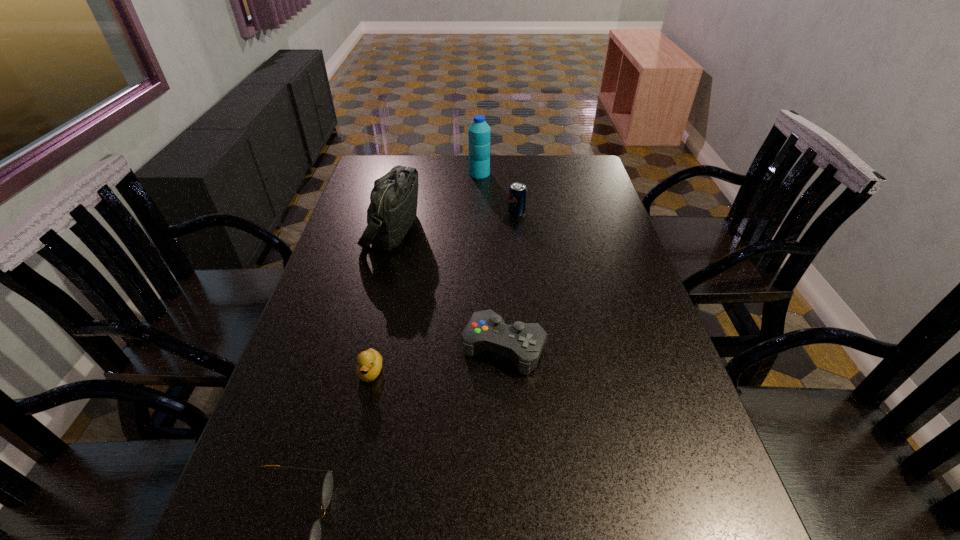
Identify the location of free point between the shoulder bag and the control. The height and width of the screenshot is (540, 960). (448, 288).

The height and width of the screenshot is (540, 960). I want to click on free space between the soda can and the control, so point(510,280).

Locate an element on the screen. The height and width of the screenshot is (540, 960). free spot between the control and the shoulder bag is located at coordinates (448, 288).

The image size is (960, 540). I want to click on free point between the third tallest object and the shoulder bag, so (x=454, y=221).

This screenshot has width=960, height=540. Find the location of `vacant region between the control and the water bottle`. vacant region between the control and the water bottle is located at coordinates (492, 260).

Select which object is the fourth closest to the duckling. Please provide its 2D coordinates. Your answer should be formatted as a tuple, i.e. [(x, y)], where the tuple contains the x and y coordinates of a point satisfying the conditions above.

[(517, 193)]

Identify which object is the third closest to the control. Please provide its 2D coordinates. Your answer should be formatted as a tuple, i.e. [(x, y)], where the tuple contains the x and y coordinates of a point satisfying the conditions above.

[(315, 535)]

Locate an element on the screen. vacant region that satisfies the following two spatial constraints: 1. on the back side of the control; 2. at the front padded panel of the shoulder bag is located at coordinates (497, 229).